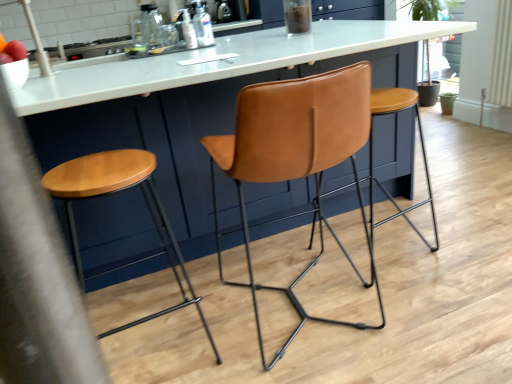
At what (x,y) coordinates should I click in order to perform the action: click on free space to the left of cognac leather chair at center. Please return your answer as a coordinate pair (x, y). Looking at the image, I should click on (199, 297).